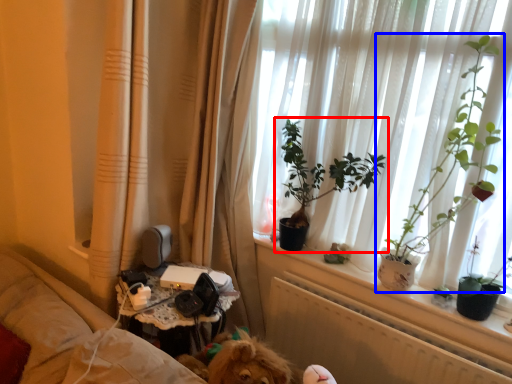
Question: Which of the following is the closest to the observer, houseplant (highlighted by a red box) or houseplant (highlighted by a blue box)?

Choices:
 (A) houseplant
 (B) houseplant

Answer: (B)